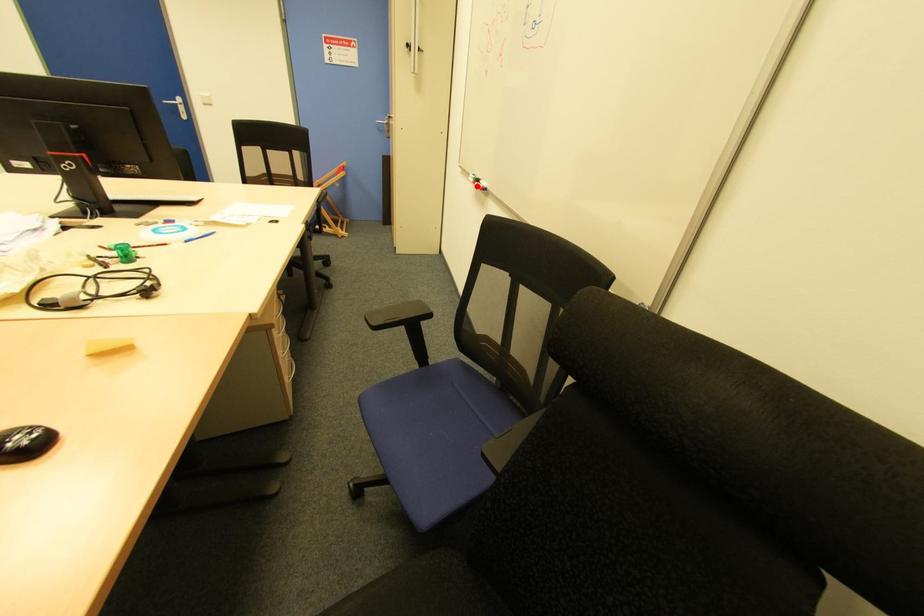
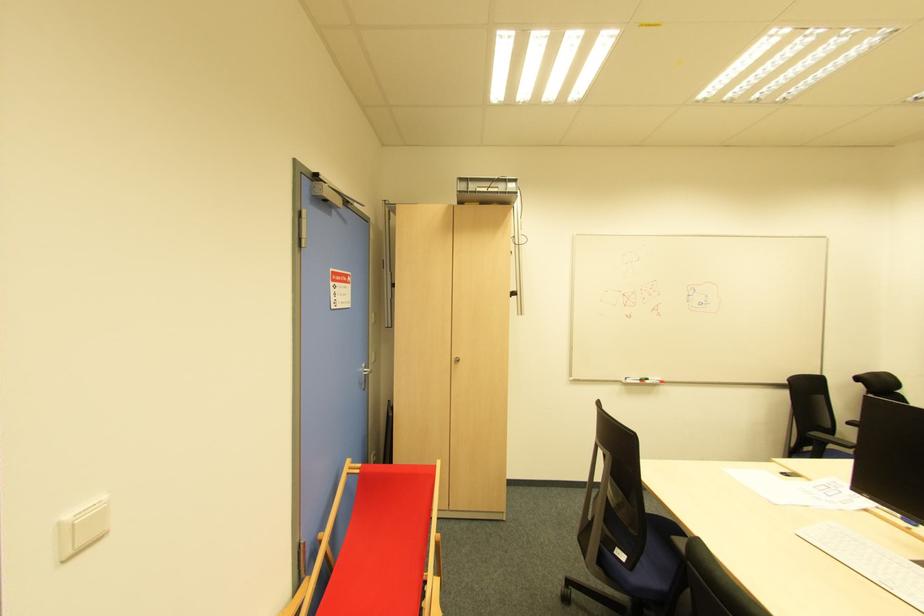
Question: A red point is marked in image1. In image2, is the corresponding 3D point closer to the camera or farther? Reply with the corresponding letter.

Choices:
 (A) The corresponding 3D point is closer.
 (B) The corresponding 3D point is farther.

Answer: (B)